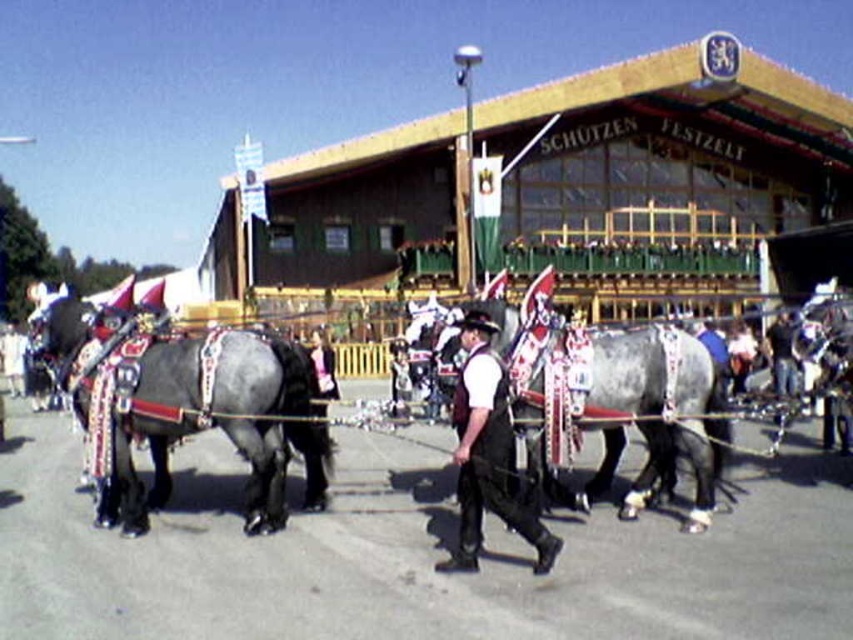
Based on the photo, is shiny silver horse at center smaller than shiny black horse at center?

Actually, shiny silver horse at center might be larger than shiny black horse at center.

Which of these two, shiny silver horse at center or shiny black horse at center, stands taller?

With more height is shiny silver horse at center.

Looking at this image, who is more forward, [492,435] or [131,384]?

Point [492,435] is more forward.

Where is `shiny silver horse at center`? This screenshot has width=853, height=640. shiny silver horse at center is located at coordinates (657, 412).

Does gray glossy horse at center lie in front of white shirt and dark vest at center?

No, gray glossy horse at center is further to the viewer.

Is point (646, 348) positioned behind point (463, 451)?

That is True.

The width and height of the screenshot is (853, 640). I want to click on gray glossy horse at center, so click(x=639, y=420).

What do you see at coordinates (189, 410) in the screenshot?
I see `shiny black horse at center` at bounding box center [189, 410].

Is point (253, 424) positioned behind point (489, 340)?

Yes, it is.

Locate an element on the screen. shiny black horse at center is located at coordinates (189, 410).